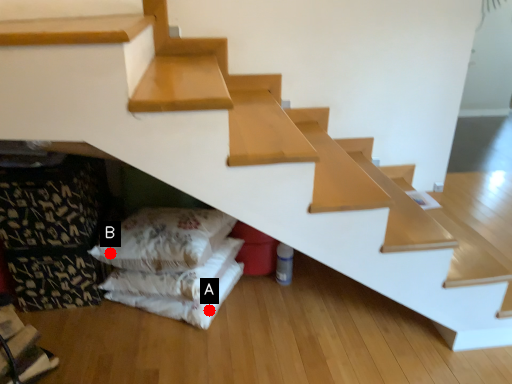
Question: Two points are circled on the image, labeled by A and B beside each circle. Among these points, which one is nearest to the camera?

Choices:
 (A) A is closer
 (B) B is closer

Answer: (B)